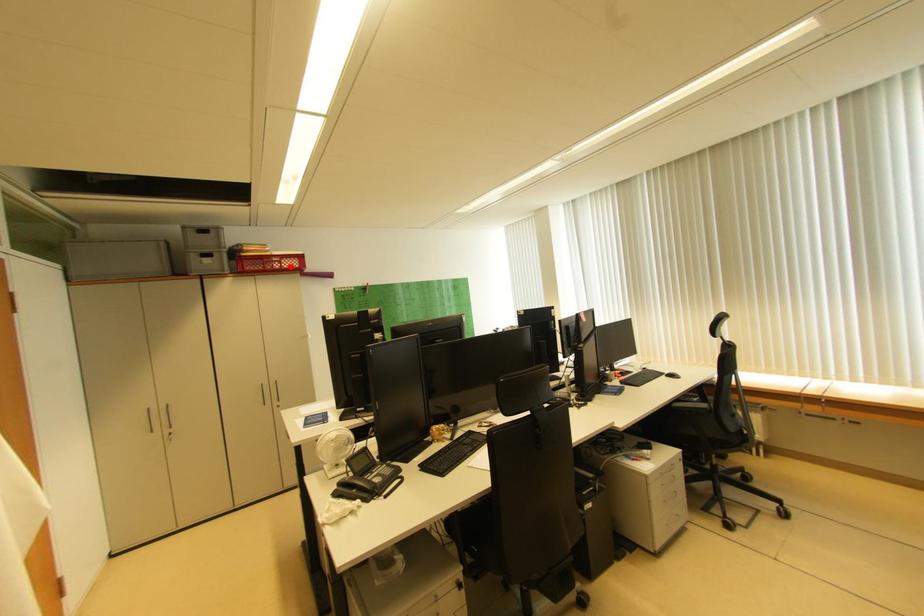
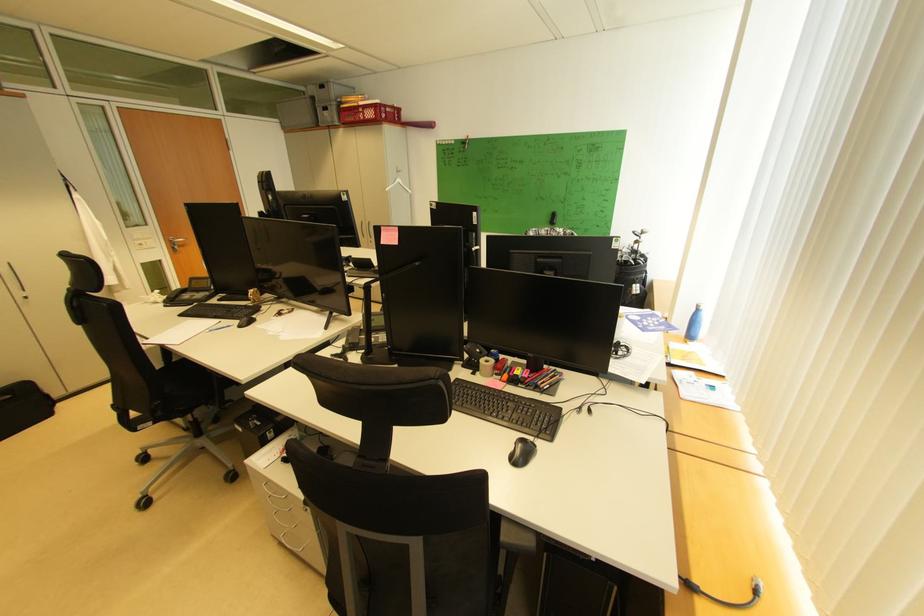
Where in the second image is the point corresponding to the highlighted location from the first image?

(372, 118)